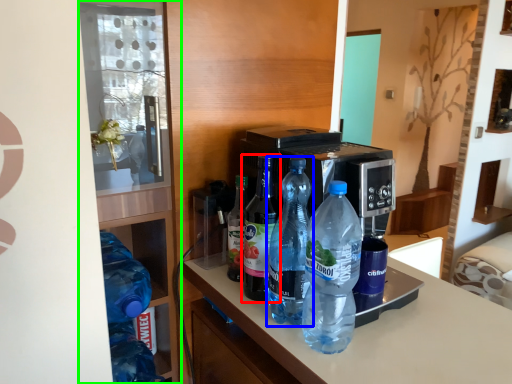
Question: Which object is the closest to the bottle (highlighted by a red box)? Choose among these: bottle (highlighted by a blue box) or shelf (highlighted by a green box).

Choices:
 (A) bottle
 (B) shelf

Answer: (A)